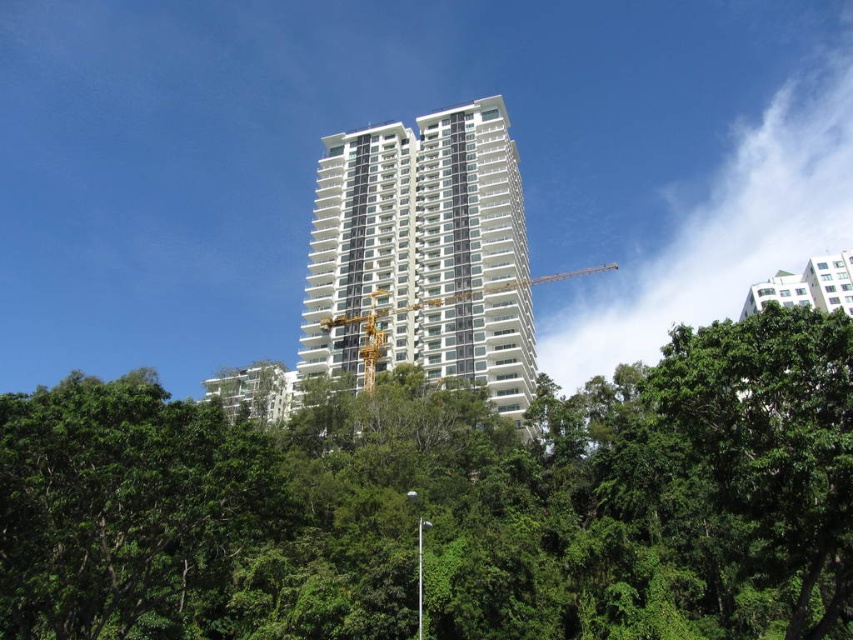
Looking at this image, you are standing in front of the white glossy building at center and want to walk to the green leafy tree at center. Which direction should you face to move towards it?

You should face to the left because the green leafy tree at center is to the left of the white glossy building at center.

You are a city planner assessing the space between the green leafy tree at center and the yellow metallic crane at center. Which object takes up more space in the image?

The yellow metallic crane at center takes up more space in the image because it is larger than the green leafy tree at center.

You are standing in front of the modern high rise building and want to take a photo of the building with the green leafy tree at center in the frame. Where should you position yourself relative to the tree to ensure the tree is centered in your photo?

To center the green leafy tree at center in your photo, you should position yourself directly in front of the tree at point (448, 506), aligning the camera with its 2D location.